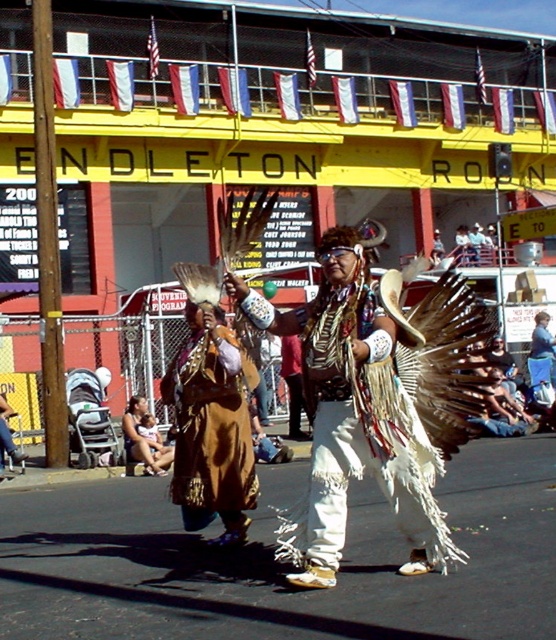
Question: Which of the following is the closest to the observer?

Choices:
 (A) (191, 465)
 (B) (540, 321)

Answer: (A)

Question: Can you confirm if brown suede dress at center is positioned above brown leather dress at lower left?

Choices:
 (A) no
 (B) yes

Answer: (B)

Question: Which of these objects is positioned farthest from the brown leather dress at lower left?

Choices:
 (A) brown suede dress at center
 (B) white fringed feathers at center
 (C) brown feathered headdress at center

Answer: (B)

Question: Can you confirm if white fringed feathers at center is positioned to the right of brown suede dress at center?

Choices:
 (A) no
 (B) yes

Answer: (B)

Question: Among these objects, which one is farthest from the camera?

Choices:
 (A) white fringed feathers at center
 (B) brown feathered headdress at center
 (C) brown suede dress at center
 (D) brown leather dress at lower left

Answer: (B)

Question: Does white fringed feathers at center appear under brown leather dress at lower left?

Choices:
 (A) no
 (B) yes

Answer: (A)